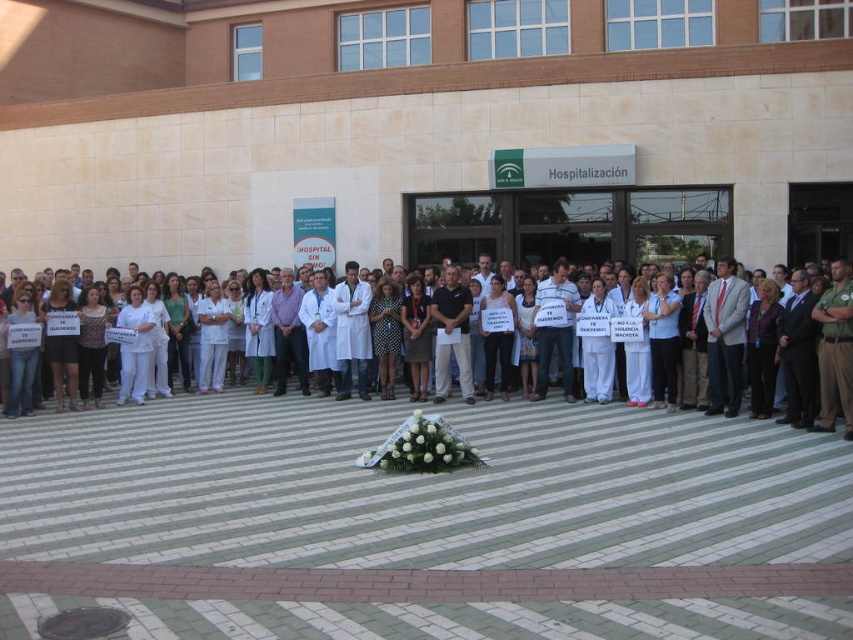
Question: Can you confirm if white lab coats at center is smaller than brown uniform at right?

Choices:
 (A) yes
 (B) no

Answer: (B)

Question: Is white lab coats at center below brown uniform at right?

Choices:
 (A) no
 (B) yes

Answer: (B)

Question: Which object appears closest to the camera in this image?

Choices:
 (A) white lab coats at center
 (B) brown uniform at right

Answer: (A)

Question: Does white lab coats at center have a lesser width compared to brown uniform at right?

Choices:
 (A) no
 (B) yes

Answer: (A)